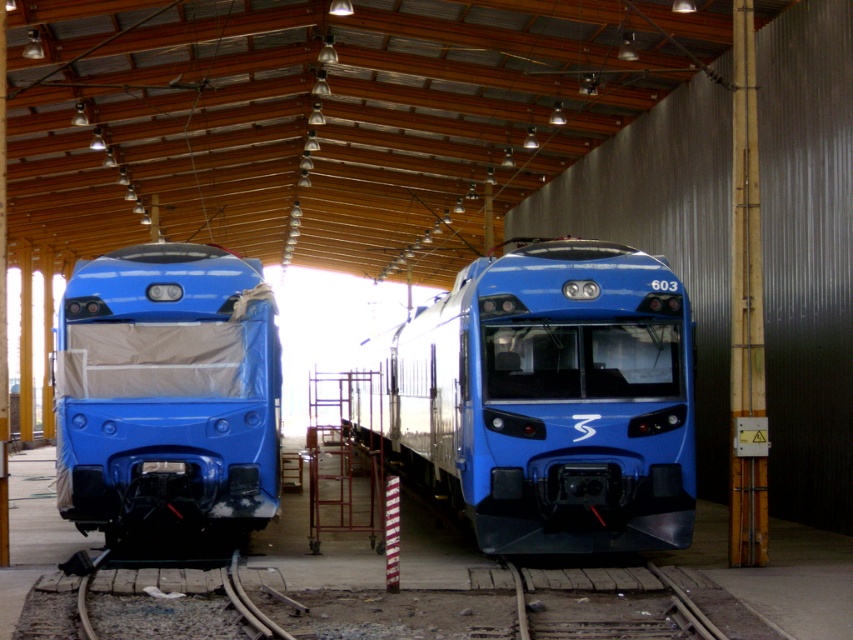
Question: Can you confirm if matte blue train at center is thinner than matte blue train at left?

Choices:
 (A) no
 (B) yes

Answer: (A)

Question: Which object appears farthest from the camera in this image?

Choices:
 (A) matte blue train at center
 (B) matte blue train at left

Answer: (B)

Question: Is matte blue train at center wider than matte blue train at left?

Choices:
 (A) no
 (B) yes

Answer: (B)

Question: Among these points, which one is nearest to the camera?

Choices:
 (A) (236, 323)
 (B) (480, 483)

Answer: (B)

Question: Is matte blue train at center smaller than matte blue train at left?

Choices:
 (A) yes
 (B) no

Answer: (B)